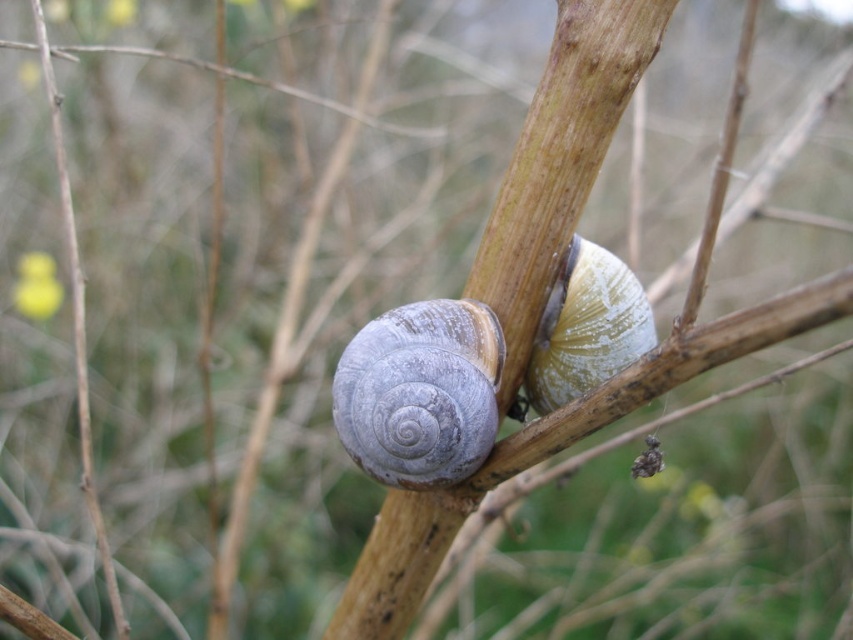
Is point (386, 321) positioned after point (625, 330)?

No, (386, 321) is closer to viewer.

Does point (440, 419) come in front of point (540, 369)?

Yes, it is.

This screenshot has width=853, height=640. Find the location of `gray matte snail at center`. gray matte snail at center is located at coordinates (421, 392).